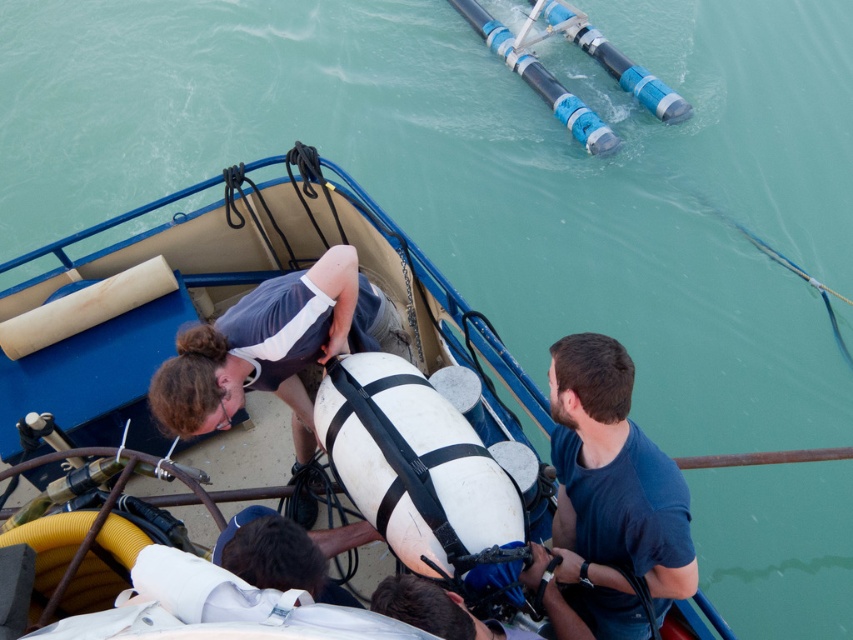
Question: Can you confirm if dark blue t-shirt at center is positioned above matte gray wetsuit at center?

Choices:
 (A) yes
 (B) no

Answer: (B)

Question: Which of the following is the farthest from the observer?

Choices:
 (A) (291, 292)
 (B) (621, 372)

Answer: (A)

Question: Which point is closer to the camera?

Choices:
 (A) (610, 424)
 (B) (314, 346)

Answer: (A)

Question: Where is dark blue t-shirt at center located in relation to matte gray wetsuit at center in the image?

Choices:
 (A) below
 (B) above

Answer: (A)

Question: In this image, where is dark blue t-shirt at center located relative to matte gray wetsuit at center?

Choices:
 (A) above
 (B) below

Answer: (B)

Question: Which of the following is the closest to the observer?

Choices:
 (A) dark blue t-shirt at center
 (B) matte gray wetsuit at center

Answer: (A)